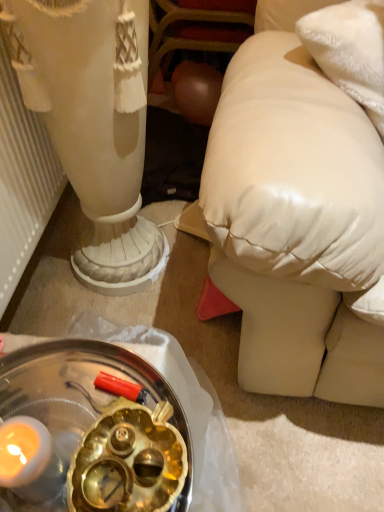
Question: Is satin white vase at center at the left side of shiny metallic tray at lower left?

Choices:
 (A) yes
 (B) no

Answer: (A)

Question: Could you tell me if satin white vase at center is turned towards shiny metallic tray at lower left?

Choices:
 (A) yes
 (B) no

Answer: (B)

Question: From a real-world perspective, is satin white vase at center under shiny metallic tray at lower left?

Choices:
 (A) yes
 (B) no

Answer: (A)

Question: Is satin white vase at center positioned far away from shiny metallic tray at lower left?

Choices:
 (A) no
 (B) yes

Answer: (A)

Question: From the image's perspective, is satin white vase at center under shiny metallic tray at lower left?

Choices:
 (A) yes
 (B) no

Answer: (B)

Question: Can we say satin white vase at center lies outside shiny metallic tray at lower left?

Choices:
 (A) yes
 (B) no

Answer: (A)

Question: Can you confirm if shiny metallic tray at lower left is taller than satin white vase at center?

Choices:
 (A) no
 (B) yes

Answer: (A)

Question: Considering the relative sizes of shiny metallic tray at lower left and satin white vase at center in the image provided, is shiny metallic tray at lower left wider than satin white vase at center?

Choices:
 (A) yes
 (B) no

Answer: (B)

Question: Considering the relative sizes of shiny metallic tray at lower left and satin white vase at center in the image provided, is shiny metallic tray at lower left thinner than satin white vase at center?

Choices:
 (A) no
 (B) yes

Answer: (B)

Question: Is shiny metallic tray at lower left further to the viewer compared to satin white vase at center?

Choices:
 (A) yes
 (B) no

Answer: (B)

Question: Could you tell me if shiny metallic tray at lower left is turned towards satin white vase at center?

Choices:
 (A) yes
 (B) no

Answer: (B)

Question: Are shiny metallic tray at lower left and satin white vase at center located far from each other?

Choices:
 (A) no
 (B) yes

Answer: (A)

Question: From a real-world perspective, is satin white vase at center above or below shiny metallic tray at lower left?

Choices:
 (A) above
 (B) below

Answer: (B)